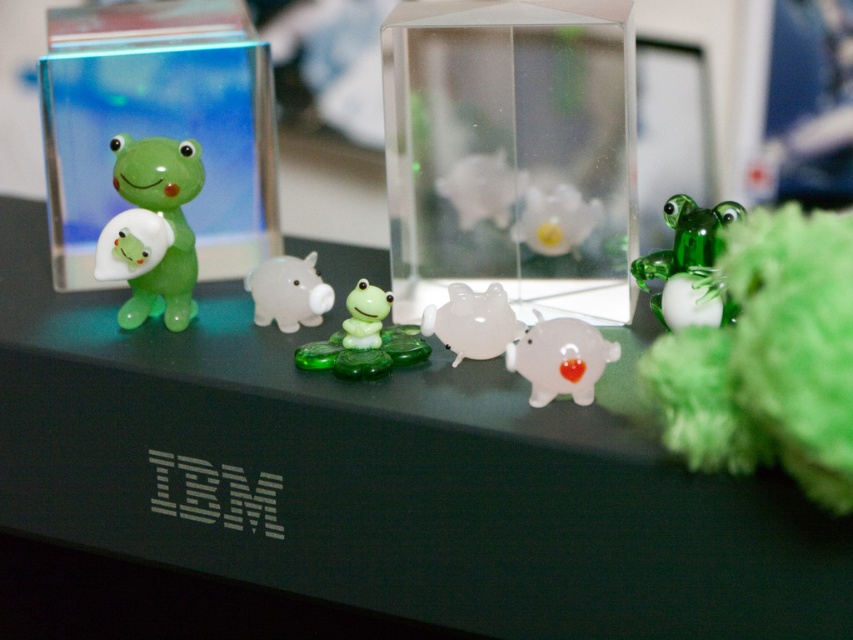
Question: Is transparent glass table at center smaller than transparent glass cube at center?

Choices:
 (A) no
 (B) yes

Answer: (A)

Question: Estimate the real-world distances between objects in this image. Which object is farther from the green glass frog at center?

Choices:
 (A) green translucent frog at left
 (B) transparent glass table at center
 (C) translucent white piggy bank at center
 (D) translucent green frog at center

Answer: (A)

Question: Which object is closer to the camera taking this photo?

Choices:
 (A) transparent glass piggy bank at center
 (B) transparent glass cube at center

Answer: (A)

Question: Which point is farther to the camera?

Choices:
 (A) green glass frog at right
 (B) transparent glass cube at center

Answer: (B)

Question: Considering the relative positions of translucent green frog at center and white glossy piggy bank at center in the image provided, where is translucent green frog at center located with respect to white glossy piggy bank at center?

Choices:
 (A) below
 (B) above

Answer: (A)

Question: Observing the image, what is the correct spatial positioning of transparent glass table at center in reference to green glass frog at right?

Choices:
 (A) above
 (B) below

Answer: (B)